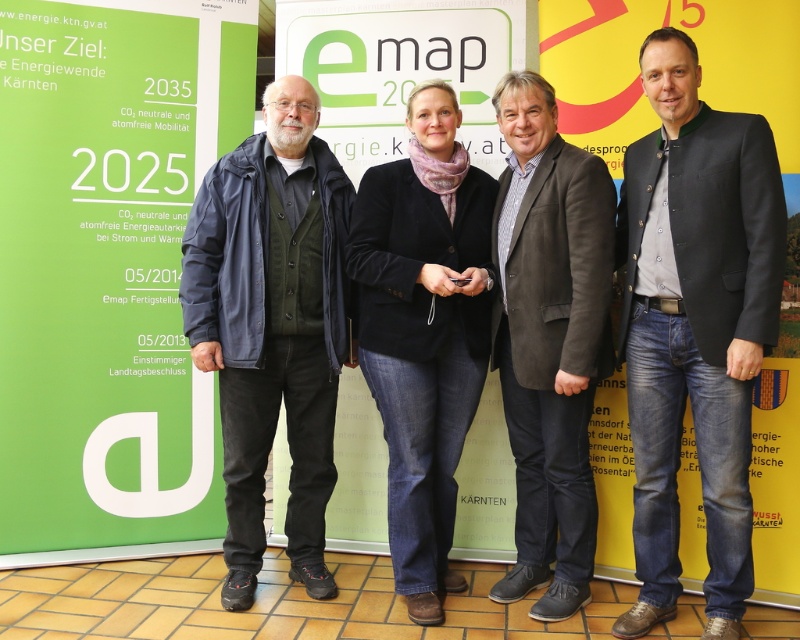
Looking at the two center items, the velvet black blazer at center and the brown suede jacket at center, which one is positioned to the left?

The velvet black blazer at center is positioned to the left of the brown suede jacket at center.

You are organizing an event and need to place a new banner between the green paperboard sign at left and the brown suede jacket at center. According to their heights, which object should the new banner be placed above to ensure it is visible over both?

The green paperboard sign at left is much taller than the brown suede jacket at center, so the new banner should be placed above the green paperboard sign at left to ensure visibility over both objects.